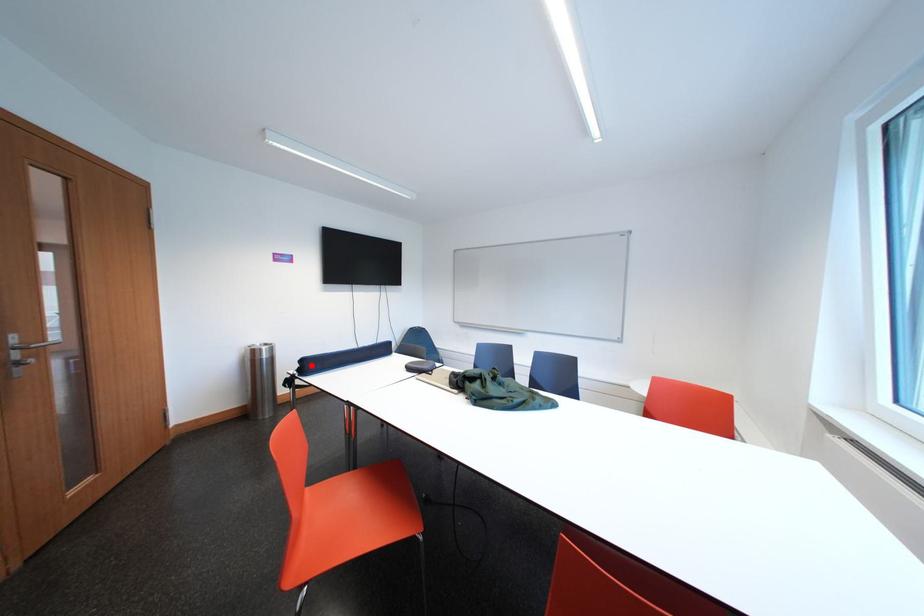
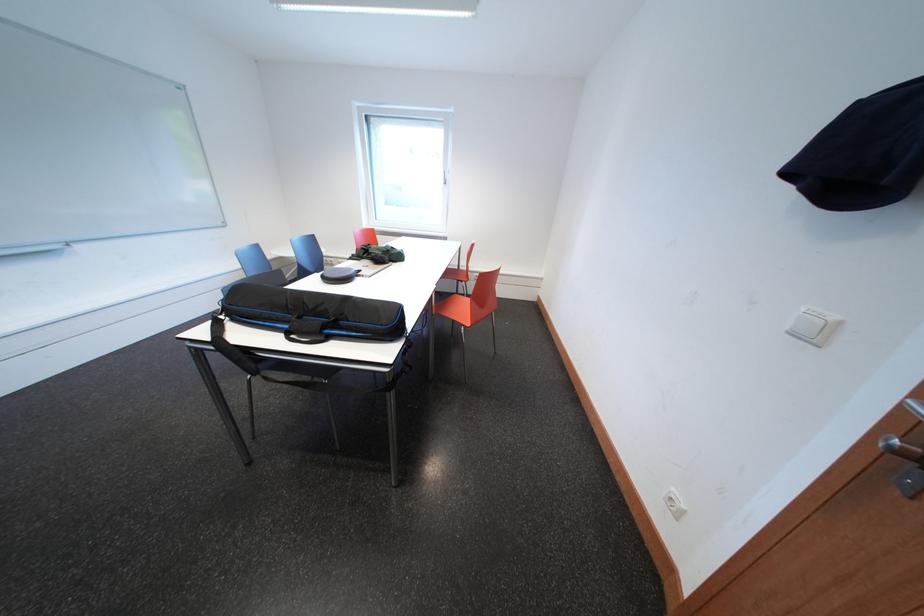
Question: I am providing you with two images of the same scene from different viewpoints. A red point is marked on the first image. Is the red point's position out of view in image 2?

Choices:
 (A) Yes
 (B) No

Answer: (A)